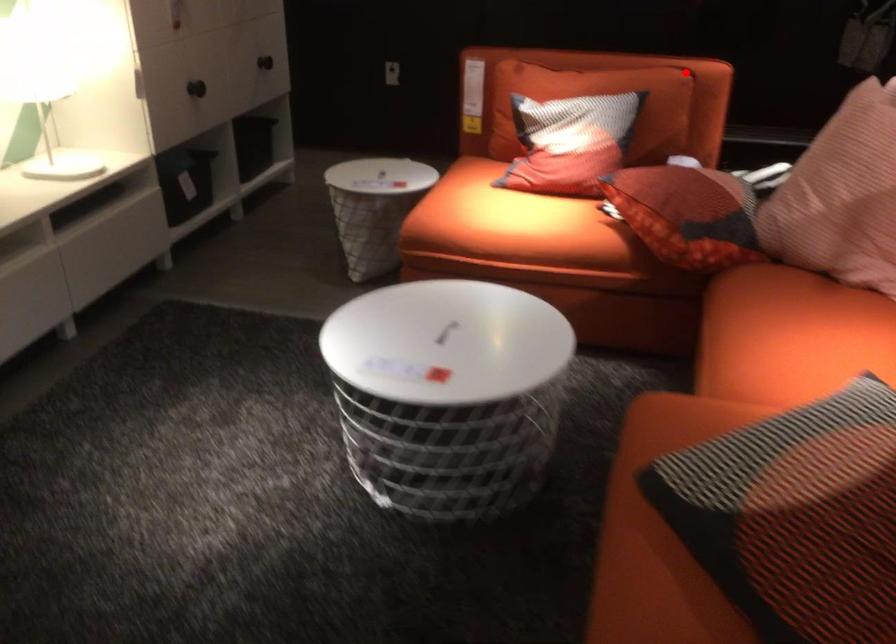
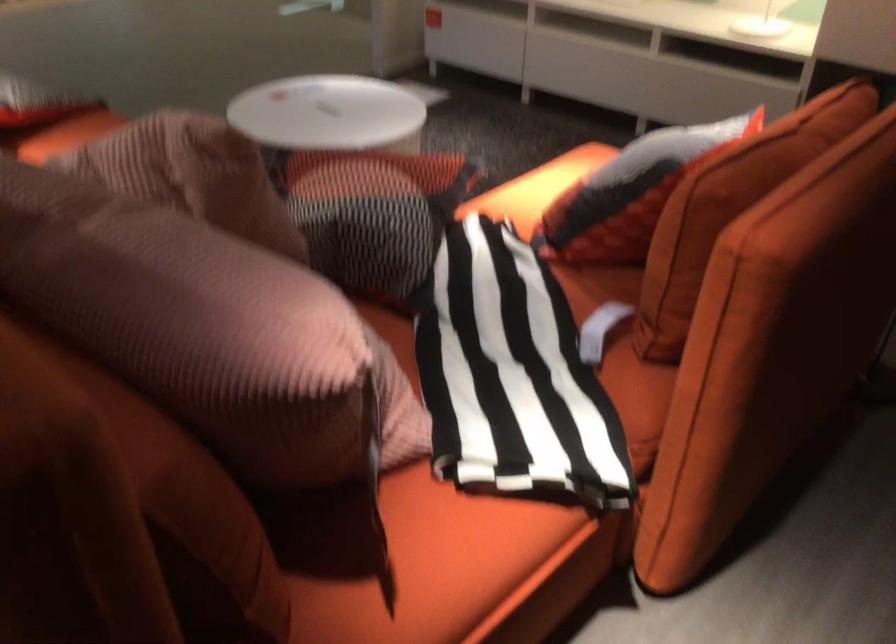
Where in the second image is the point corresponding to the highlighted location from the first image?

(730, 207)